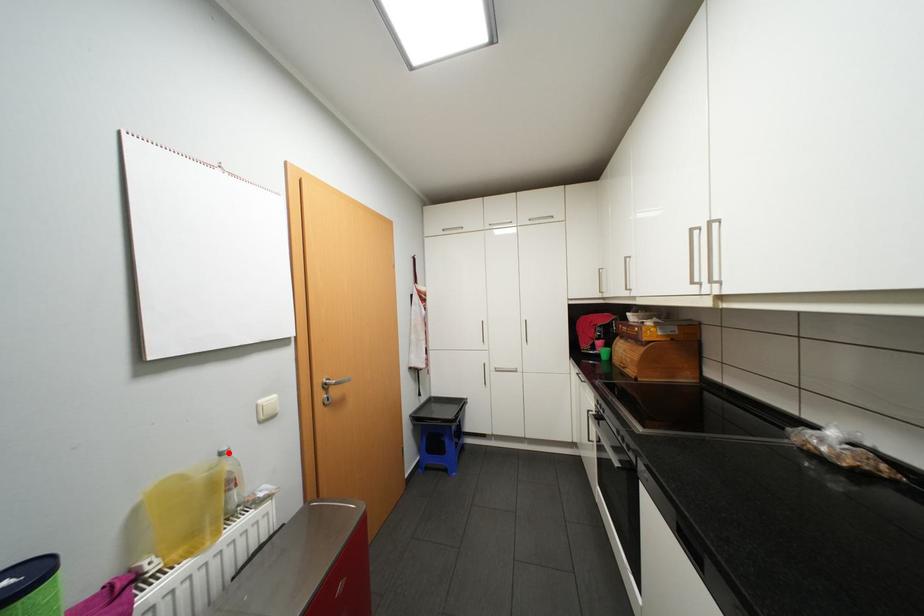
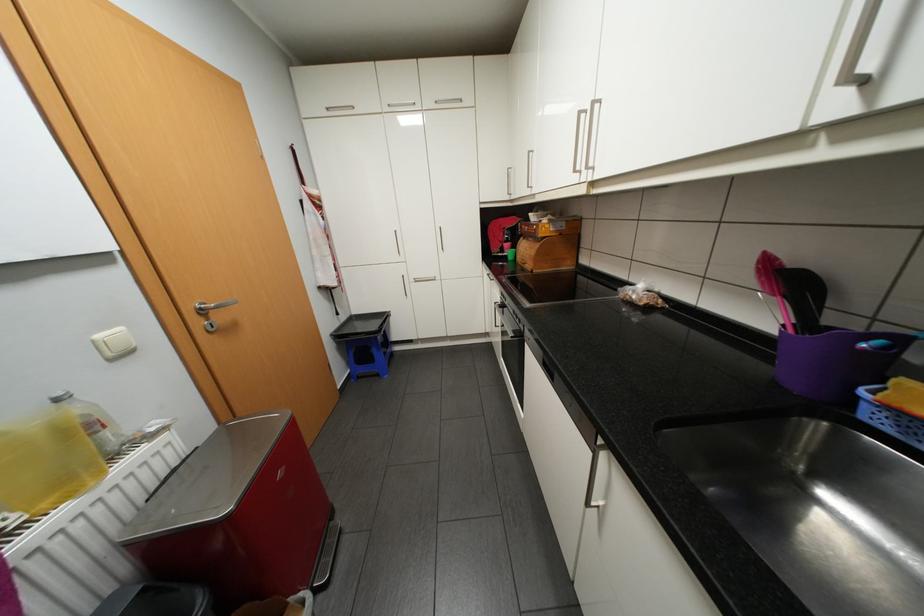
Locate, in the second image, the point that corresponds to the highlighted location in the first image.

(65, 399)